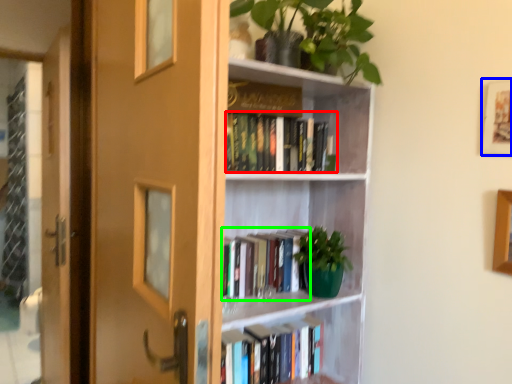
Question: Which object is positioned farthest from book (highlighted by a red box)? Select from picture frame (highlighted by a blue box) and book (highlighted by a green box).

Choices:
 (A) picture frame
 (B) book

Answer: (A)